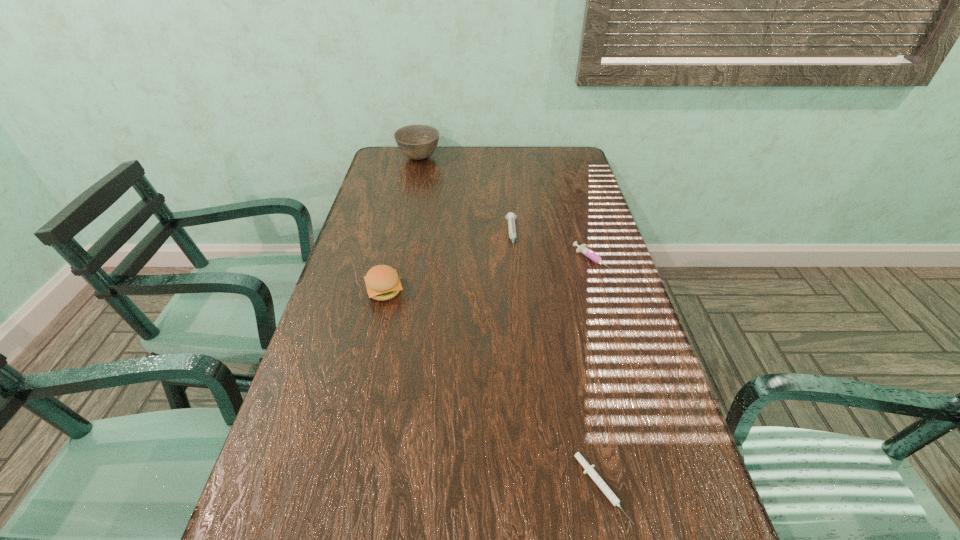
The width and height of the screenshot is (960, 540). What are the coordinates of `free location at the far right corner of the desktop` in the screenshot? It's located at click(x=545, y=146).

Identify the location of free space that is in between the second tallest object and the bowl. (401, 225).

The image size is (960, 540). I want to click on free space between the second tallest object and the tallest object, so click(401, 225).

I want to click on free space between the second nearest object and the third object from right to left, so click(448, 263).

Identify the location of vacant area between the nearest object and the rightmost object. (597, 374).

Locate an element on the screen. This screenshot has width=960, height=540. vacant space that is in between the rightmost syringe and the hamburger is located at coordinates (489, 276).

The height and width of the screenshot is (540, 960). Find the location of `free area in between the nearest object and the third object from left to right`. free area in between the nearest object and the third object from left to right is located at coordinates (557, 362).

Identify the location of empty location between the third object from left to right and the rightmost syringe. (x=552, y=248).

Find the location of `free space between the tallest object and the hamburger`. free space between the tallest object and the hamburger is located at coordinates (401, 225).

At what (x,y) coordinates should I click in order to perform the action: click on vacant space in between the leftmost syringe and the second object from right to left. Please return your answer as a coordinate pair (x, y). Looking at the image, I should click on (557, 362).